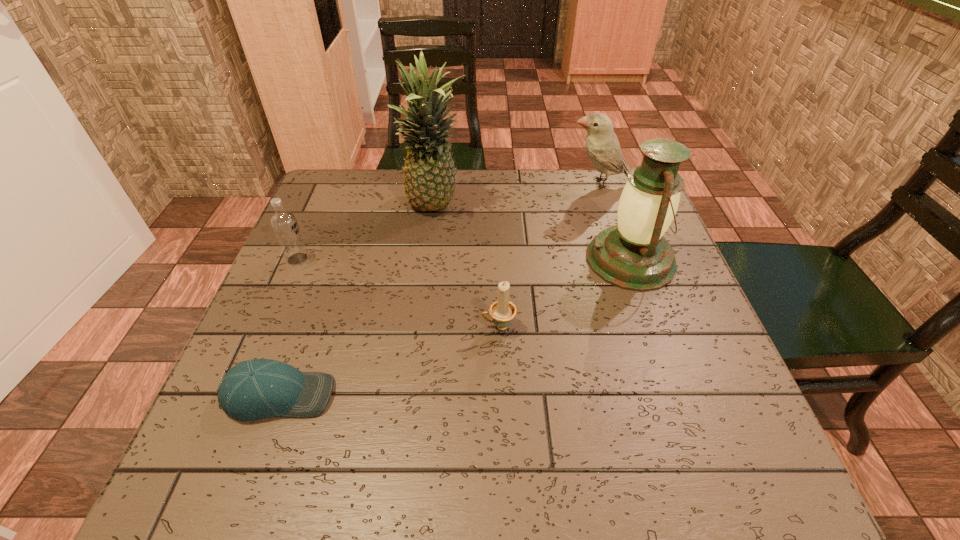
I want to click on vacant space at the left edge of the desktop, so click(x=339, y=276).

Identify the location of vacant space at the right edge. The height and width of the screenshot is (540, 960). pos(646,361).

In the image, there is a desktop. Where is `vacant area at the far left corner`? The width and height of the screenshot is (960, 540). vacant area at the far left corner is located at coordinates (370, 193).

In the image, there is a desktop. At what (x,y) coordinates should I click in order to perform the action: click on vacant space at the near right corner. Please return your answer as a coordinate pair (x, y). The width and height of the screenshot is (960, 540). Looking at the image, I should click on (782, 485).

The image size is (960, 540). I want to click on free spot between the nearest object and the fourth tallest object, so click(x=289, y=327).

At what (x,y) coordinates should I click in order to perform the action: click on vacant area that lies between the fourth object from left to right and the shortest object. Please return your answer as a coordinate pair (x, y). Looking at the image, I should click on (389, 361).

Identify the location of free space that is in between the baseball cap and the tallest object. (358, 301).

The width and height of the screenshot is (960, 540). Find the location of `empty location between the candle_holder and the tallest object`. empty location between the candle_holder and the tallest object is located at coordinates (468, 267).

The image size is (960, 540). Identify the location of vacant region between the bird and the fourth object from right to left. (517, 195).

I want to click on vacant space that's between the bird and the lantern, so click(x=614, y=221).